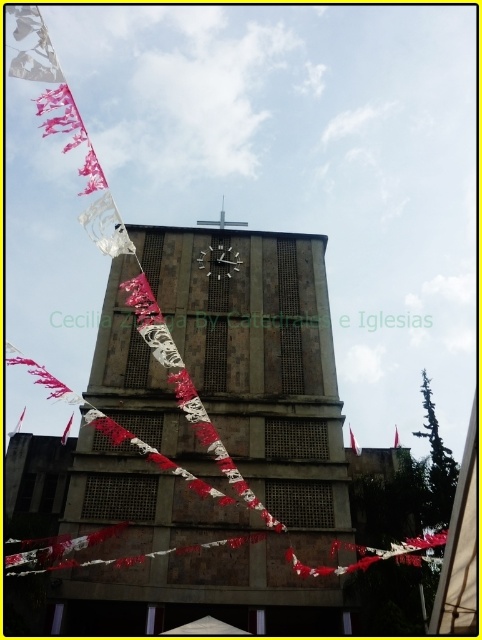
Question: Which object is farther from the camera taking this photo?

Choices:
 (A) white paper flag at lower left
 (B) white fabric flag at upper center

Answer: (B)

Question: Among these points, which one is farthest from the camera?

Choices:
 (A) [x=65, y=433]
 (B) [x=224, y=266]

Answer: (A)

Question: Can you confirm if brown textured stone clock tower at center is positioned to the left of red fabric flag at upper center?

Choices:
 (A) no
 (B) yes

Answer: (B)

Question: Based on their relative distances, which object is nearer to the red fabric flag at upper center?

Choices:
 (A) metallic clock at center
 (B) white fabric flag at upper center

Answer: (B)

Question: From the image, what is the correct spatial relationship of metallic clock at center in relation to white fabric flag at upper center?

Choices:
 (A) above
 (B) below

Answer: (A)

Question: Is metallic clock at center behind white fabric flag at upper center?

Choices:
 (A) yes
 (B) no

Answer: (A)